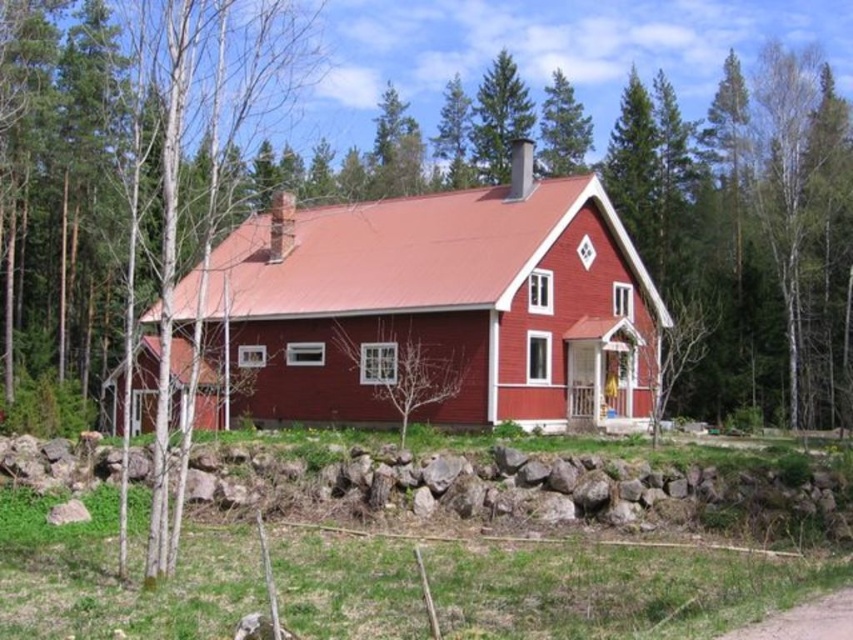
This screenshot has height=640, width=853. In order to click on green textured pine tree at upper center in this screenshot , I will do `click(498, 118)`.

Is point (492, 113) farther from camera compared to point (543, 173)?

Yes, point (492, 113) is farther from viewer.

This screenshot has width=853, height=640. I want to click on green textured pine tree at upper center, so click(498, 118).

Can you confirm if bare wood tree at center is positioned to the left of matte red barn at center?

Incorrect, bare wood tree at center is not on the left side of matte red barn at center.

Does point (608, 177) come in front of point (335, 348)?

No, it is behind (335, 348).

Is point (335, 420) positioned before point (422, 248)?

Yes, point (335, 420) is closer to viewer.

At what (x,y) coordinates should I click in order to perform the action: click on bare wood tree at center. Please return your answer as a coordinate pair (x, y). The height and width of the screenshot is (640, 853). Looking at the image, I should click on (425, 228).

Can you confirm if matte red barn at center is bigger than green textured pine tree at upper center?

Correct, matte red barn at center is larger in size than green textured pine tree at upper center.

Measure the distance between matte red barn at center and green textured pine tree at upper center.

matte red barn at center and green textured pine tree at upper center are 34.63 meters apart.

Between point (227, 298) and point (496, 84), which one is positioned behind?

Positioned behind is point (496, 84).

The image size is (853, 640). I want to click on matte red barn at center, so click(x=444, y=304).